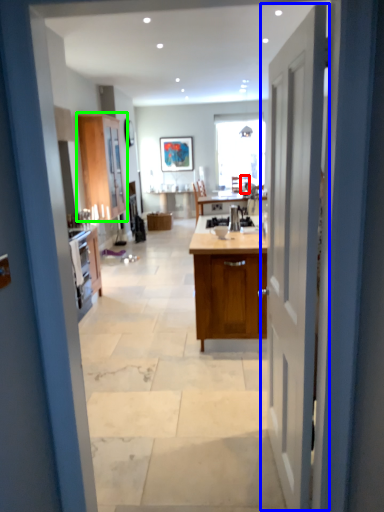
Question: Considering the real-world distances, which object is closest to chair (highlighted by a red box)? door (highlighted by a blue box) or cabinetry (highlighted by a green box).

Choices:
 (A) door
 (B) cabinetry

Answer: (B)